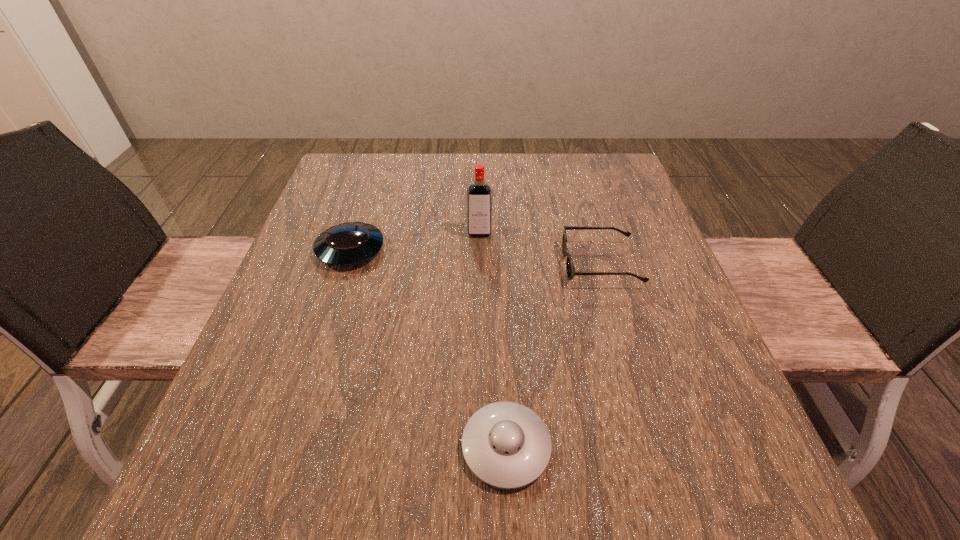
I want to click on vacant space at the far right corner of the desktop, so click(585, 198).

Where is `free space at the near right corner`? The width and height of the screenshot is (960, 540). free space at the near right corner is located at coordinates (772, 481).

The width and height of the screenshot is (960, 540). What are the coordinates of `vacant area that lies between the right saucer and the leftmost object` in the screenshot? It's located at pyautogui.click(x=428, y=348).

Where is `free point between the vodka and the nearer saucer`? free point between the vodka and the nearer saucer is located at coordinates (492, 340).

Identify the location of vacant area that lies between the right saucer and the sunglasses. This screenshot has width=960, height=540. (553, 356).

Identify the location of vacant area that lies between the vodka and the taller saucer. (415, 242).

Where is `vacant point located between the shorter saucer and the tallest object`? This screenshot has height=540, width=960. vacant point located between the shorter saucer and the tallest object is located at coordinates (492, 340).

Locate an element on the screen. The height and width of the screenshot is (540, 960). free space between the shortest object and the rightmost object is located at coordinates (553, 356).

You are a GUI agent. You are given a task and a screenshot of the screen. Output one action in this format:
    pyautogui.click(x=<x>, y=<y>)
    Task: Click on the vacant point located between the farther saucer and the sunglasses
    The width and height of the screenshot is (960, 540).
    Given the screenshot: What is the action you would take?
    pyautogui.click(x=475, y=258)

Find the location of `vacant space that's between the tallest object and the shortest object`. vacant space that's between the tallest object and the shortest object is located at coordinates (492, 340).